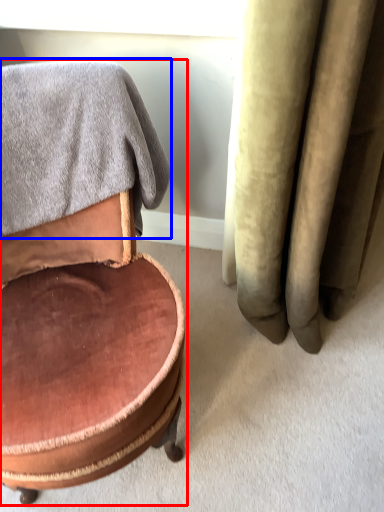
Question: Among these objects, which one is nearest to the camera, chair (highlighted by a red box) or bath towel (highlighted by a blue box)?

Choices:
 (A) chair
 (B) bath towel

Answer: (A)